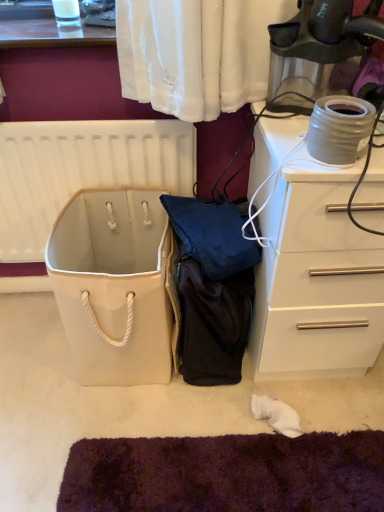
What is the approximate height of matte gray ceramic pot at upper right?

4.12 inches.

Image resolution: width=384 pixels, height=512 pixels. Identify the location of white canvas bag at center. (113, 286).

Describe the element at coordinates (82, 170) in the screenshot. This screenshot has height=512, width=384. I see `white plastic radiator at upper left` at that location.

At what (x,y) coordinates should I click in order to perform the action: click on matte gray ceramic pot at upper right. Please return your answer as a coordinate pair (x, y). The height and width of the screenshot is (512, 384). Looking at the image, I should click on (339, 128).

From the image's perspective, is matte gray ceramic pot at upper right below white plastic radiator at upper left?

No, from the image's perspective, matte gray ceramic pot at upper right is not below white plastic radiator at upper left.

Based on the photo, how different are the orientations of matte gray ceramic pot at upper right and white plastic radiator at upper left in degrees?

The facing directions of matte gray ceramic pot at upper right and white plastic radiator at upper left are 0.788 degrees apart.

Which object is thinner, matte gray ceramic pot at upper right or white plastic radiator at upper left?

With smaller width is white plastic radiator at upper left.

Find the location of a particular element. appliance that appears above the white plastic radiator at upper left (from the image's perspective) is located at coordinates (339, 128).

Is white plastic radiator at upper left inside or outside of white canvas bag at center?

white plastic radiator at upper left is outside white canvas bag at center.

Between white plastic radiator at upper left and white canvas bag at center, which one appears on the right side from the viewer's perspective?

white canvas bag at center.

Who is shorter, white plastic radiator at upper left or white canvas bag at center?

white canvas bag at center.

Is white plastic radiator at upper left positioned with its back to white canvas bag at center?

Absolutely, white plastic radiator at upper left is directed away from white canvas bag at center.

Between matte gray ceramic pot at upper right and white glossy chest of drawers at right, which one is positioned in front?

matte gray ceramic pot at upper right is in front.

Is matte gray ceramic pot at upper right located outside white glossy chest of drawers at right?

Yes, matte gray ceramic pot at upper right is outside of white glossy chest of drawers at right.

Are matte gray ceramic pot at upper right and white glossy chest of drawers at right far apart?

No.

Considering the relative positions of white canvas bag at center and white plastic radiator at upper left in the image provided, is white canvas bag at center to the left or to the right of white plastic radiator at upper left?

Clearly, white canvas bag at center is on the right of white plastic radiator at upper left in the image.

Is white canvas bag at center positioned with its back to white plastic radiator at upper left?

Yes, white canvas bag at center is facing away from white plastic radiator at upper left.

Who is shorter, white canvas bag at center or white plastic radiator at upper left?

white canvas bag at center.

Is point (81, 224) in front of point (18, 227)?

Yes, point (81, 224) is closer to viewer.

How many degrees apart are the facing directions of white glossy chest of drawers at right and white canvas bag at center?

1.39 degrees.

From the image's perspective, is white glossy chest of drawers at right above or below white canvas bag at center?

white glossy chest of drawers at right is above white canvas bag at center.

Does point (294, 222) come farther from viewer compared to point (153, 354)?

No, it is in front of (153, 354).

In the scene shown: Who is taller, white glossy chest of drawers at right or white canvas bag at center?

Standing taller between the two is white glossy chest of drawers at right.

Does matte gray ceramic pot at upper right have a lesser height compared to white canvas bag at center?

Correct, matte gray ceramic pot at upper right is not as tall as white canvas bag at center.

Based on the photo, from the image's perspective, relative to white canvas bag at center, is matte gray ceramic pot at upper right above or below?

matte gray ceramic pot at upper right is situated higher than white canvas bag at center in the image.

Visually, is matte gray ceramic pot at upper right positioned to the left or to the right of white canvas bag at center?

matte gray ceramic pot at upper right is to the right of white canvas bag at center.

Considering the sizes of matte gray ceramic pot at upper right and white canvas bag at center in the image, is matte gray ceramic pot at upper right wider or thinner than white canvas bag at center?

matte gray ceramic pot at upper right is thinner than white canvas bag at center.

Is white glossy chest of drawers at right not near matte gray ceramic pot at upper right?

No, white glossy chest of drawers at right is not far away from matte gray ceramic pot at upper right.

Is white glossy chest of drawers at right wider or thinner than matte gray ceramic pot at upper right?

white glossy chest of drawers at right is wider than matte gray ceramic pot at upper right.

Considering the points (266, 137) and (355, 127), which point is in front, point (266, 137) or point (355, 127)?

Point (355, 127)

From their relative heights in the image, would you say white glossy chest of drawers at right is taller or shorter than matte gray ceramic pot at upper right?

In the image, white glossy chest of drawers at right appears to be taller than matte gray ceramic pot at upper right.

Where is `radiator that is under the matte gray ceramic pot at upper right (from a real-world perspective)`? Image resolution: width=384 pixels, height=512 pixels. radiator that is under the matte gray ceramic pot at upper right (from a real-world perspective) is located at coordinates (82, 170).

Where is `wide that is in front of the white plastic radiator at upper left`? This screenshot has height=512, width=384. wide that is in front of the white plastic radiator at upper left is located at coordinates (113, 286).

When comparing their distances from white glossy chest of drawers at right, does white plastic radiator at upper left or matte gray ceramic pot at upper right seem further?

The object further to white glossy chest of drawers at right is white plastic radiator at upper left.

Looking at the image, which one is located further to white canvas bag at center, matte gray ceramic pot at upper right or white plastic radiator at upper left?

matte gray ceramic pot at upper right is further to white canvas bag at center.

Based on their spatial positions, is white canvas bag at center or white glossy chest of drawers at right closer to white plastic radiator at upper left?

white canvas bag at center.

Estimate the real-world distances between objects in this image. Which object is closer to white glossy chest of drawers at right, matte gray ceramic pot at upper right or white canvas bag at center?

matte gray ceramic pot at upper right is positioned closer to the anchor white glossy chest of drawers at right.

When comparing their distances from matte gray ceramic pot at upper right, does white plastic radiator at upper left or white canvas bag at center seem further?

Among the two, white plastic radiator at upper left is located further to matte gray ceramic pot at upper right.

Based on their spatial positions, is white glossy chest of drawers at right or matte gray ceramic pot at upper right closer to white plastic radiator at upper left?

Among the two, white glossy chest of drawers at right is located nearer to white plastic radiator at upper left.

Looking at the image, which one is located further to matte gray ceramic pot at upper right, white plastic radiator at upper left or white glossy chest of drawers at right?

Among the two, white plastic radiator at upper left is located further to matte gray ceramic pot at upper right.

Which object lies further to the anchor point white canvas bag at center, matte gray ceramic pot at upper right or white glossy chest of drawers at right?

Based on the image, matte gray ceramic pot at upper right appears to be further to white canvas bag at center.

Find the location of `wide located between white plastic radiator at upper left and matte gray ceramic pot at upper right in the left-right direction`. wide located between white plastic radiator at upper left and matte gray ceramic pot at upper right in the left-right direction is located at coordinates (113, 286).

Where is `appliance between white canvas bag at center and white glossy chest of drawers at right in the horizontal direction`? appliance between white canvas bag at center and white glossy chest of drawers at right in the horizontal direction is located at coordinates (339, 128).

In order to click on appliance between white plastic radiator at upper left and white glossy chest of drawers at right in this screenshot , I will do `click(339, 128)`.

Locate an element on the screen. Image resolution: width=384 pixels, height=512 pixels. wide between white plastic radiator at upper left and white glossy chest of drawers at right in the horizontal direction is located at coordinates (113, 286).